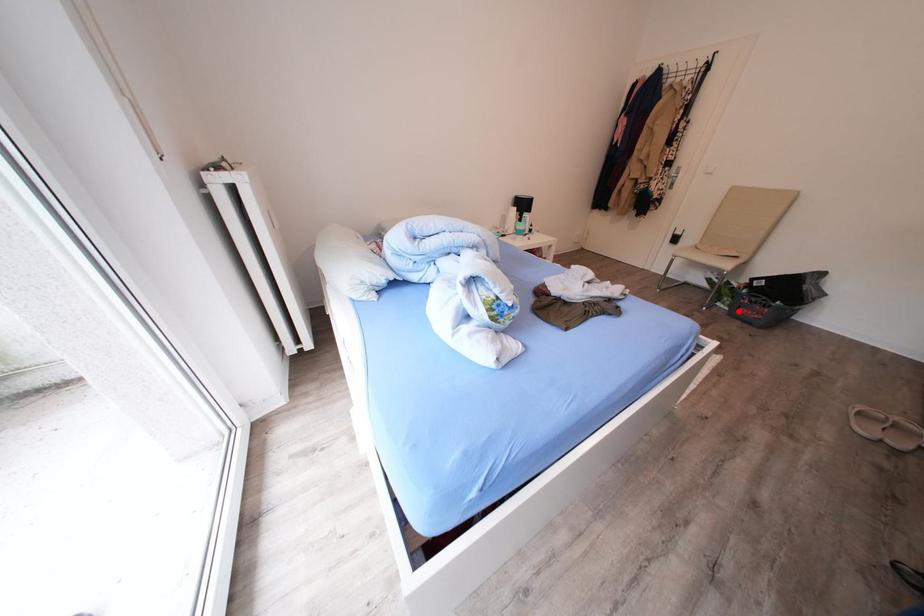
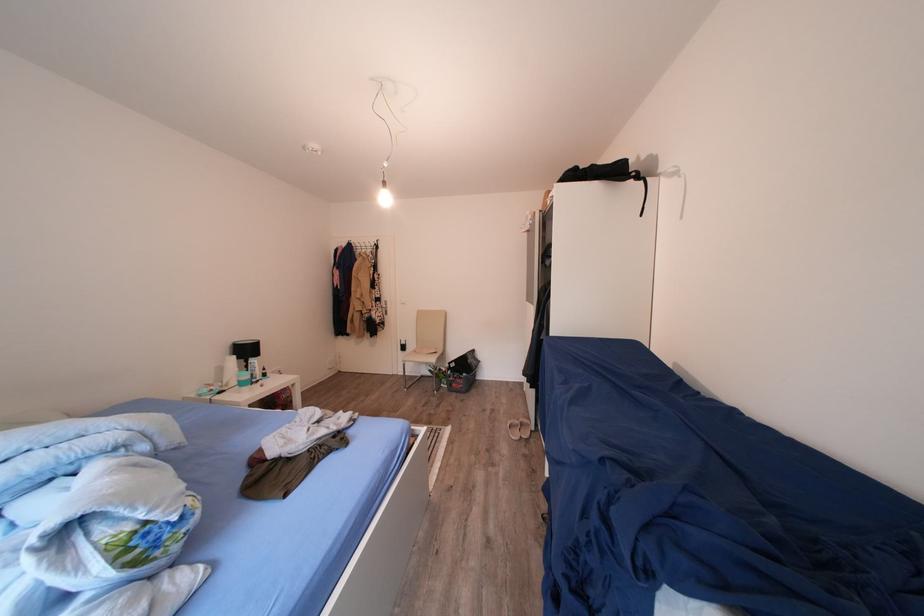
Where in the second image is the point corresponding to the highlighted location from the first image?

(456, 390)